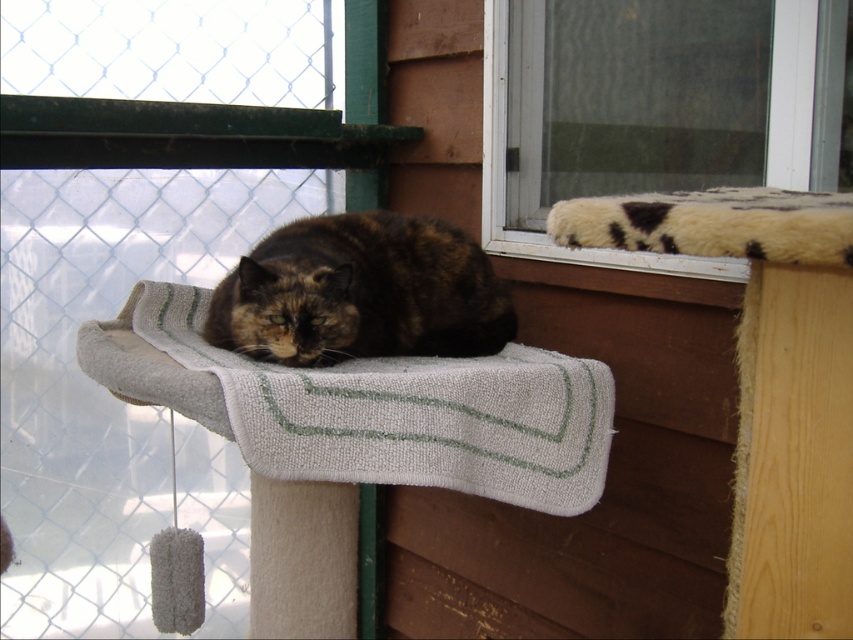
Question: Estimate the real-world distances between objects in this image. Which object is closer to the fuzzy white cushion at upper right?

Choices:
 (A) white textured mat at center
 (B) dark tortoiseshell fur at center

Answer: (B)

Question: Observing the image, what is the correct spatial positioning of fuzzy white cushion at upper right in reference to white textured mat at center?

Choices:
 (A) right
 (B) left

Answer: (A)

Question: Does fuzzy white cushion at upper right have a larger size compared to dark tortoiseshell fur at center?

Choices:
 (A) no
 (B) yes

Answer: (B)

Question: Is fuzzy white cushion at upper right positioned at the back of white textured mat at center?

Choices:
 (A) no
 (B) yes

Answer: (A)

Question: Which object is the farthest from the fuzzy white cushion at upper right?

Choices:
 (A) white textured mat at center
 (B) dark tortoiseshell fur at center

Answer: (A)

Question: Which point is closer to the camera?

Choices:
 (A) (503, 148)
 (B) (325, 244)
 (C) (224, 384)

Answer: (C)